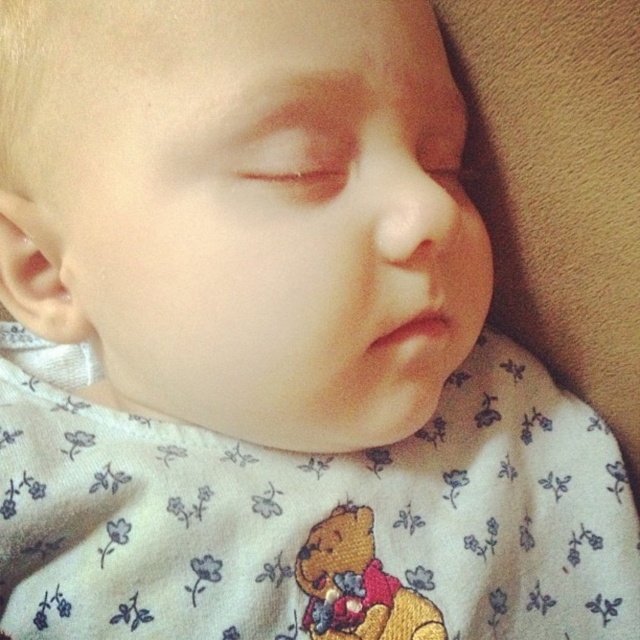
Question: Which point appears closest to the camera in this image?

Choices:
 (A) [337, 618]
 (B) [252, 436]

Answer: (A)

Question: Is smooth skin baby at center to the left of embroidered plush bear at center from the viewer's perspective?

Choices:
 (A) yes
 (B) no

Answer: (A)

Question: Among these points, which one is farthest from the camera?

Choices:
 (A) (403, 45)
 (B) (349, 580)

Answer: (B)

Question: Is the position of smooth skin baby at center less distant than that of embroidered plush bear at center?

Choices:
 (A) no
 (B) yes

Answer: (B)

Question: Does smooth skin baby at center come behind embroidered plush bear at center?

Choices:
 (A) yes
 (B) no

Answer: (B)

Question: Among these objects, which one is farthest from the camera?

Choices:
 (A) embroidered plush bear at center
 (B) smooth skin baby at center

Answer: (A)